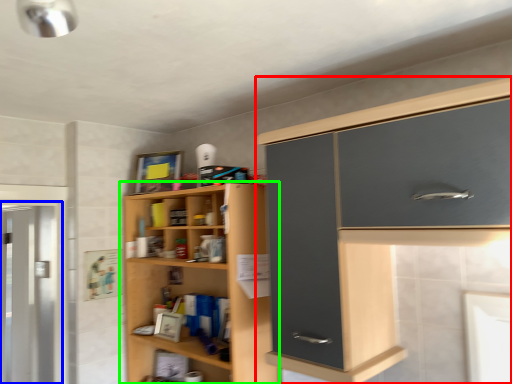
Question: Considering the real-world distances, which object is farthest from cabinetry (highlighted by a red box)? screen door (highlighted by a blue box) or cupboard (highlighted by a green box)?

Choices:
 (A) screen door
 (B) cupboard

Answer: (A)